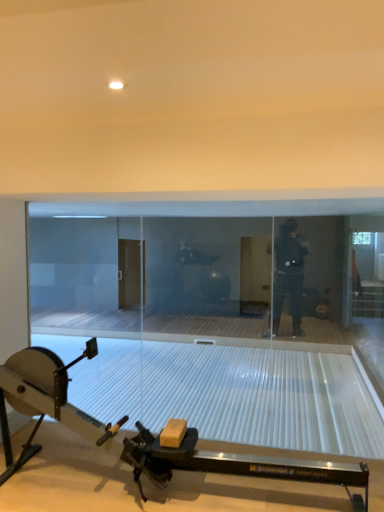
Question: Does metallic rowing machine at lower center have a lesser width compared to transparent glass door at center?

Choices:
 (A) no
 (B) yes

Answer: (A)

Question: Does metallic rowing machine at lower center appear on the left side of transparent glass door at center?

Choices:
 (A) no
 (B) yes

Answer: (B)

Question: Is metallic rowing machine at lower center at the right side of transparent glass door at center?

Choices:
 (A) no
 (B) yes

Answer: (A)

Question: Is metallic rowing machine at lower center facing towards transparent glass door at center?

Choices:
 (A) yes
 (B) no

Answer: (B)

Question: Is metallic rowing machine at lower center placed right next to transparent glass door at center?

Choices:
 (A) yes
 (B) no

Answer: (B)

Question: Does metallic rowing machine at lower center have a lesser height compared to transparent glass door at center?

Choices:
 (A) no
 (B) yes

Answer: (B)

Question: Is transparent glass door at center shorter than metallic rowing machine at lower center?

Choices:
 (A) no
 (B) yes

Answer: (A)

Question: Does transparent glass door at center have a greater height compared to metallic rowing machine at lower center?

Choices:
 (A) no
 (B) yes

Answer: (B)

Question: Considering the relative sizes of transparent glass door at center and metallic rowing machine at lower center in the image provided, is transparent glass door at center thinner than metallic rowing machine at lower center?

Choices:
 (A) yes
 (B) no

Answer: (A)

Question: From the image's perspective, is transparent glass door at center over metallic rowing machine at lower center?

Choices:
 (A) yes
 (B) no

Answer: (A)

Question: Is transparent glass door at center wider than metallic rowing machine at lower center?

Choices:
 (A) no
 (B) yes

Answer: (A)

Question: Is transparent glass door at center facing towards metallic rowing machine at lower center?

Choices:
 (A) yes
 (B) no

Answer: (B)

Question: Does point (357, 219) appear closer or farther from the camera than point (11, 384)?

Choices:
 (A) farther
 (B) closer

Answer: (A)